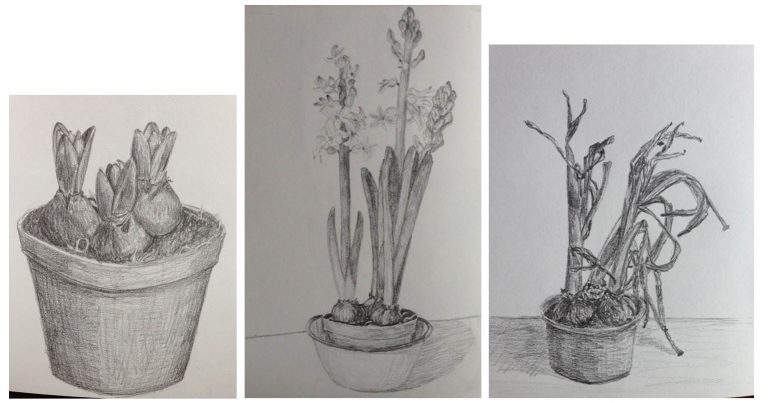
Find the location of `short, stubby plant`. short, stubby plant is located at coordinates (160, 207), (127, 235), (85, 220), (55, 213).